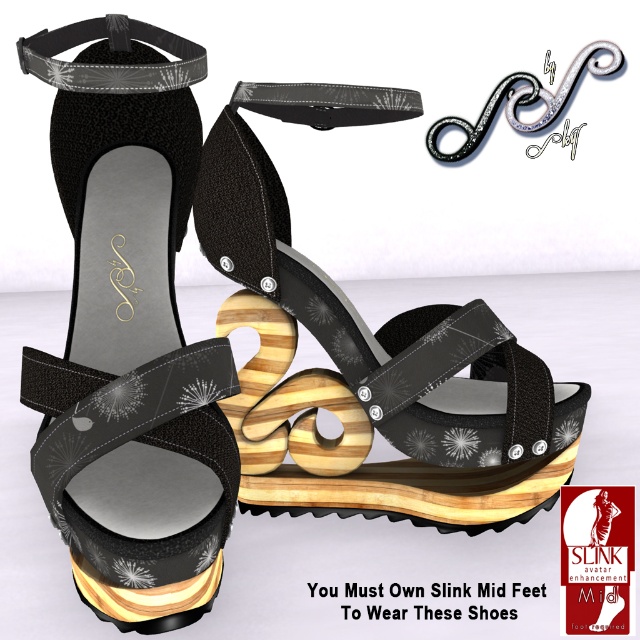
Between matte black leather sandal at center and black leather strap at upper center, which one has less height?

black leather strap at upper center

What do you see at coordinates (131, 333) in the screenshot? This screenshot has width=640, height=640. I see `matte black leather sandal at center` at bounding box center [131, 333].

Locate an element on the screen. matte black leather sandal at center is located at coordinates (131, 333).

Which of these two, black leather strap at upper center or silver metallic strap at upper center, stands taller?

silver metallic strap at upper center is taller.

Who is lower down, black leather strap at upper center or silver metallic strap at upper center?

black leather strap at upper center is lower down.

Which is in front, point (54, 68) or point (493, 106)?

Point (54, 68) is more forward.

I want to click on black leather strap at upper center, so click(108, 60).

Can you confirm if wooden platform sandal at center is taller than silver metallic strap at upper center?

Yes.

Looking at this image, between wooden platform sandal at center and silver metallic strap at upper center, which one appears on the right side from the viewer's perspective?

silver metallic strap at upper center is more to the right.

Which is in front, point (406, 401) or point (472, 132)?

Point (406, 401) is more forward.

At what (x,y) coordinates should I click in order to perform the action: click on wooden platform sandal at center. Please return your answer as a coordinate pair (x, y). Looking at the image, I should click on (380, 355).